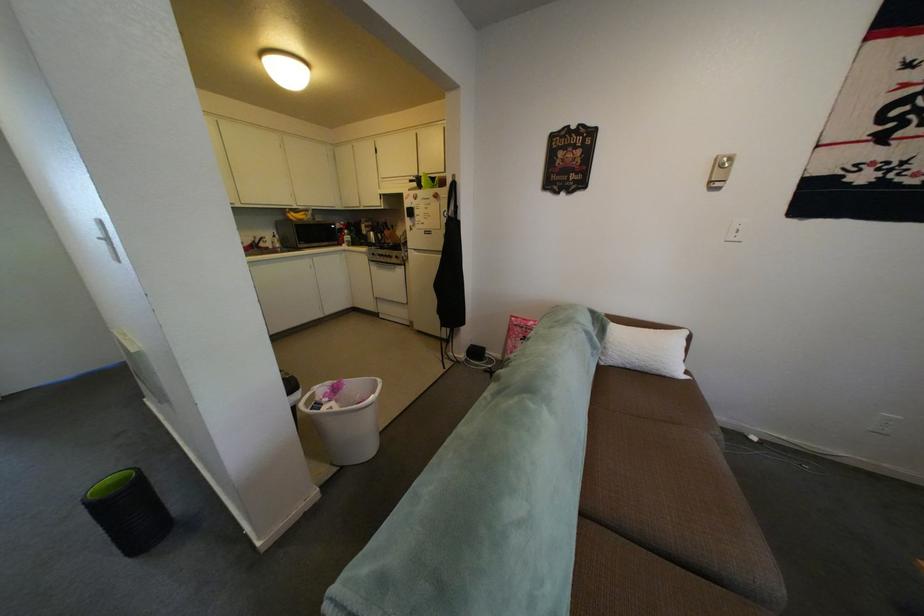
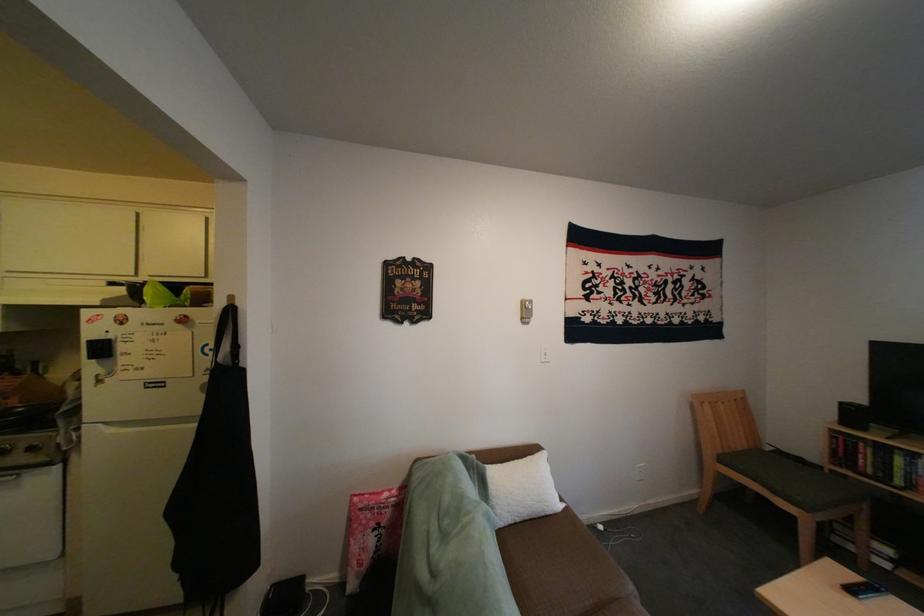
Question: The camera is either moving clockwise (left) or counter-clockwise (right) around the object. The first image is from the beginning of the video and the second image is from the end. Is the camera moving left or right when shooting the video?

Choices:
 (A) Left
 (B) Right

Answer: (A)